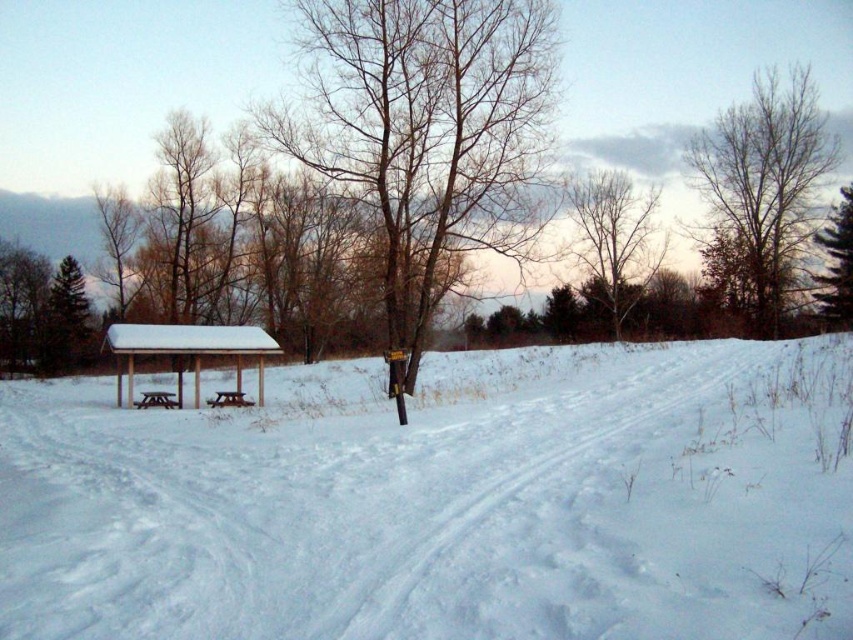
You are standing at the picnic tables in the midground of the winter scene. You notice a point marked at coordinates (762, 193). What object is located at this point?

The point at (762, 193) marks the location of a bare wood tree at upper right.